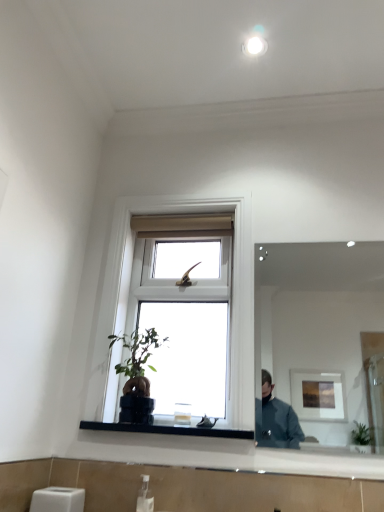
Question: In terms of size, does white plastic soap dispenser at lower center appear bigger or smaller than black glass at lower center?

Choices:
 (A) big
 (B) small

Answer: (B)

Question: From a real-world perspective, relative to black glass at lower center, is white plastic soap dispenser at lower center vertically above or below?

Choices:
 (A) above
 (B) below

Answer: (B)

Question: Estimate the real-world distances between objects in this image. Which object is farther from the white plastic soap dispenser at lower center?

Choices:
 (A) white wood window at center
 (B) white glossy light fixture at upper center
 (C) black glass at lower center
 (D) green leafy plant at center
 (E) clear glass mirror at upper right

Answer: (E)

Question: Based on their relative distances, which object is farther from the white glossy light fixture at upper center?

Choices:
 (A) white wood window at center
 (B) white plastic soap dispenser at lower center
 (C) black glass at lower center
 (D) clear glass mirror at upper right
 (E) green leafy plant at center

Answer: (D)